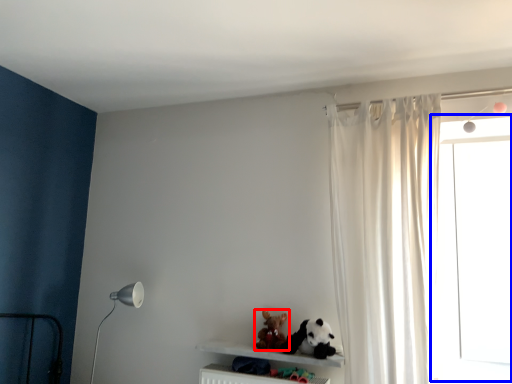
Question: Which of the following is the closest to the observer, toy (highlighted by a red box) or window frame (highlighted by a blue box)?

Choices:
 (A) toy
 (B) window frame

Answer: (B)